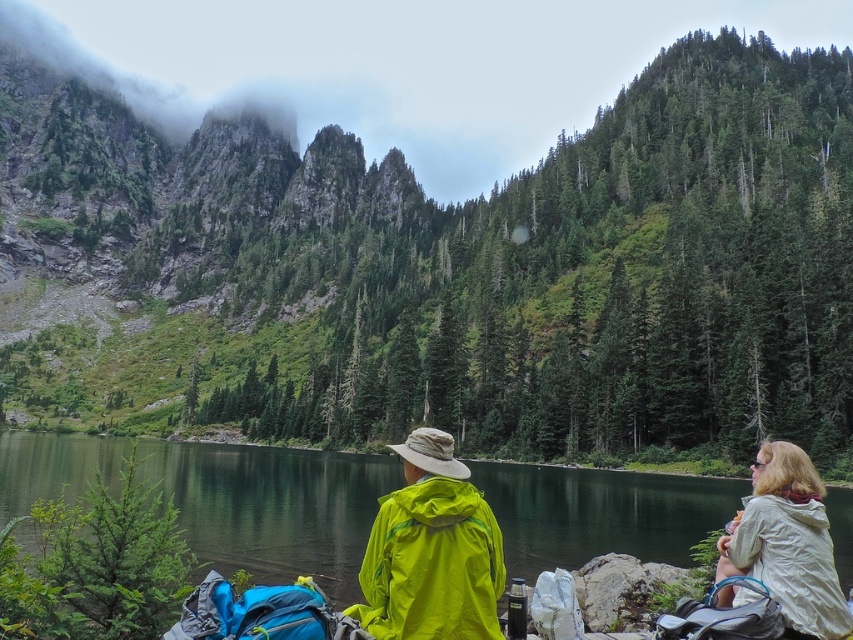
Based on the scene described, what can be found at the coordinates point (444,269)?

At point (444,269) lies green forested mountain at center.

You are a photographer trying to capture the green forested mountain at center from the shoreline where the two people are standing. What is the exact 2D coordinate of the mountain in the image?

The green forested mountain at center is located at the 2D coordinate point of [444,269].

You are planning to take a photo of the green forested mountain at center and the light beige jacket at lower right. Which object will occupy more space in your photo?

The green forested mountain at center will occupy more space in the photo because its width is larger than the light beige jacket at lower right.